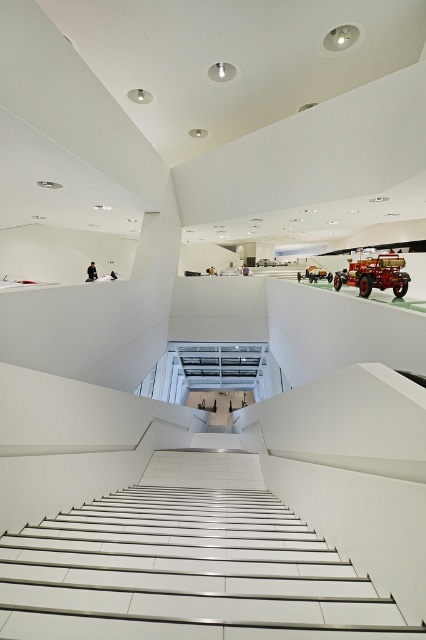
Which is below, white glossy stair at center or orange matte toy car at center?

white glossy stair at center

Who is more distant from viewer, (144,547) or (328,272)?

Positioned behind is point (328,272).

Find the location of `white glossy stair at center`. white glossy stair at center is located at coordinates (187, 564).

Which is behind, point (336, 285) or point (319, 276)?

The point (319, 276) is more distant.

What do you see at coordinates (374, 275) in the screenshot? I see `shiny red fire truck at upper center` at bounding box center [374, 275].

Is point (356, 272) positioned in front of point (316, 275)?

Yes, point (356, 272) is closer to viewer.

At what (x,y) coordinates should I click in order to perform the action: click on shiny red fire truck at upper center. Please return your answer as a coordinate pair (x, y). The height and width of the screenshot is (640, 426). Looking at the image, I should click on (374, 275).

Can you confirm if white glossy stair at center is taller than shiny red fire truck at upper center?

Incorrect, white glossy stair at center's height is not larger of shiny red fire truck at upper center's.

Is white glossy stair at center positioned in front of shiny red fire truck at upper center?

Yes, it is in front of shiny red fire truck at upper center.

Which is in front, point (3, 632) or point (383, 264)?

Point (3, 632) is in front.

Image resolution: width=426 pixels, height=640 pixels. Find the location of `white glossy stair at center`. white glossy stair at center is located at coordinates (187, 564).